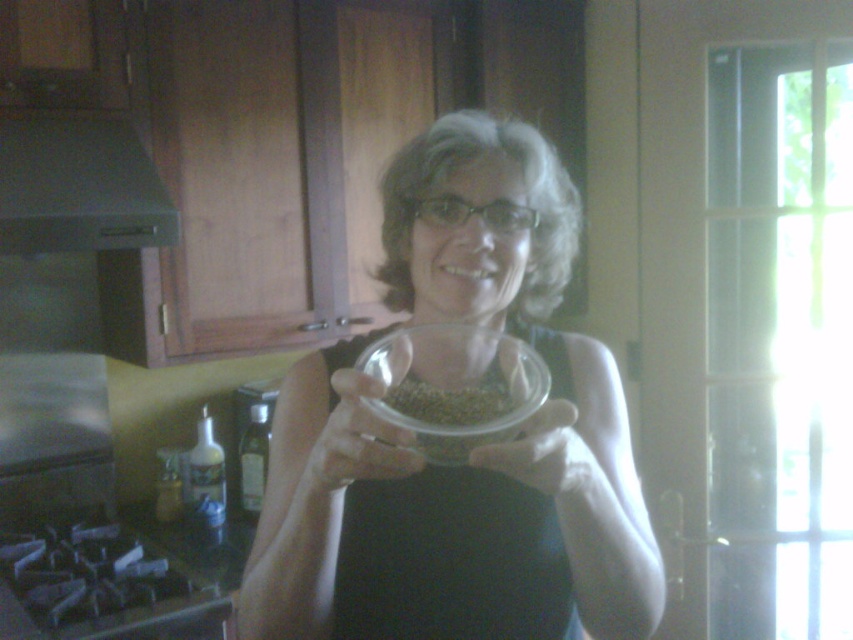
Question: Based on their relative distances, which object is nearer to the transparent plastic bowl at center?

Choices:
 (A) white matte hand at center
 (B) black fabric apron at center
 (C) green matte exhaust hood at upper left
 (D) clear plastic bowl at center

Answer: (D)

Question: Can you confirm if green matte exhaust hood at upper left is smaller than clear plastic bowl at center?

Choices:
 (A) no
 (B) yes

Answer: (A)

Question: Is green matte exhaust hood at upper left bigger than transparent plastic bowl at center?

Choices:
 (A) yes
 (B) no

Answer: (A)

Question: Which object is positioned closest to the transparent plastic bowl at center?

Choices:
 (A) green matte seeds at center
 (B) green matte exhaust hood at upper left

Answer: (A)

Question: Does black fabric apron at center appear under transparent plastic bowl at center?

Choices:
 (A) yes
 (B) no

Answer: (A)

Question: Based on their relative distances, which object is nearer to the clear glass bowl at center?

Choices:
 (A) white matte hand at center
 (B) green matte seeds at center
 (C) transparent plastic bowl at center

Answer: (C)